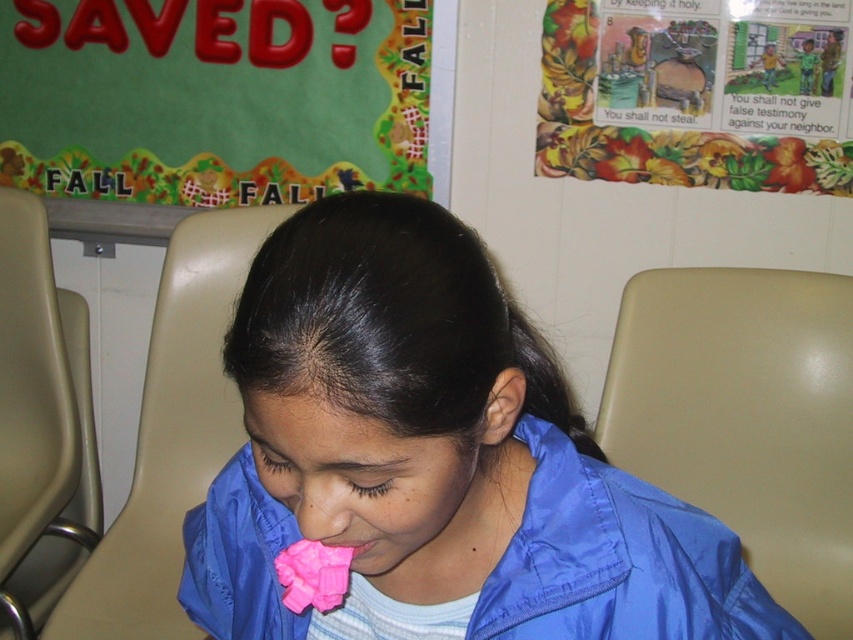
Question: Among these objects, which one is nearest to the camera?

Choices:
 (A) pink matte nose at center
 (B) green fabric bulletin board at upper left
 (C) pink matte paper at center
 (D) beige plastic chair at right

Answer: (C)

Question: Does beige plastic chair at center have a greater width compared to pink fabric toy at lower center?

Choices:
 (A) no
 (B) yes

Answer: (B)

Question: Is the position of beige plastic chair at center more distant than that of pink fabric toy at lower center?

Choices:
 (A) no
 (B) yes

Answer: (B)

Question: Which of the following is the farthest from the observer?

Choices:
 (A) (334, 481)
 (B) (236, 396)
 (C) (776, 298)
 (D) (308, 285)

Answer: (B)

Question: Which object is the closest to the beige plastic chair at lower left?

Choices:
 (A) beige plastic chair at center
 (B) pink matte paper at center
 (C) pink fabric toy at lower center

Answer: (A)

Question: Can you confirm if pink matte paper at center is wider than pink matte nose at center?

Choices:
 (A) no
 (B) yes

Answer: (B)